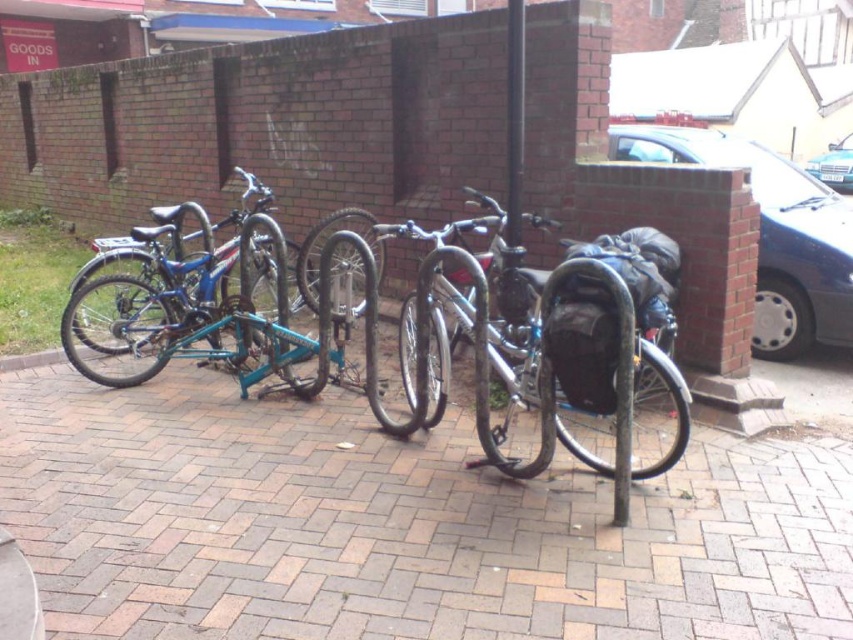
You are a delivery person who needs to move a 4 feet long box from the brick pavement at center to the blue metallic bicycle at left. Can you move the box without bending it?

The brick pavement at center and blue metallic bicycle at left are 3.92 feet apart. Since the box is 4 feet long, it is slightly longer than the distance between them. Therefore, you might need to tilt or adjust the box to fit it through the space without bending it.

You are a delivery person who needs to place a package on the ground between the brick pavement at center and the shiny metallic bicycle at center. Can you fit the package there if the package requires 1 meter of space?

The brick pavement at center is shorter than the shiny metallic bicycle at center. However, the description does not provide specific measurements about the distance between them, so it is unclear if there is enough space to fit the package requiring 1 meter of space.